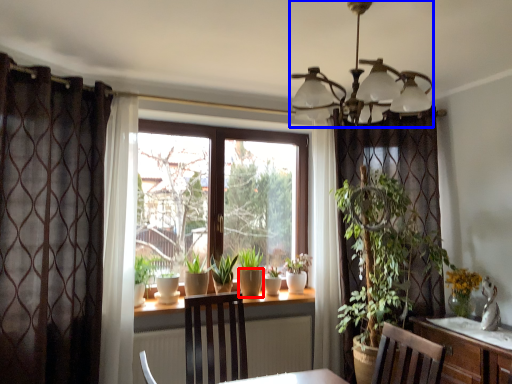
Question: Which of the following is the farthest to the observer, flowerpot (highlighted by a red box) or light fixture (highlighted by a blue box)?

Choices:
 (A) flowerpot
 (B) light fixture

Answer: (A)